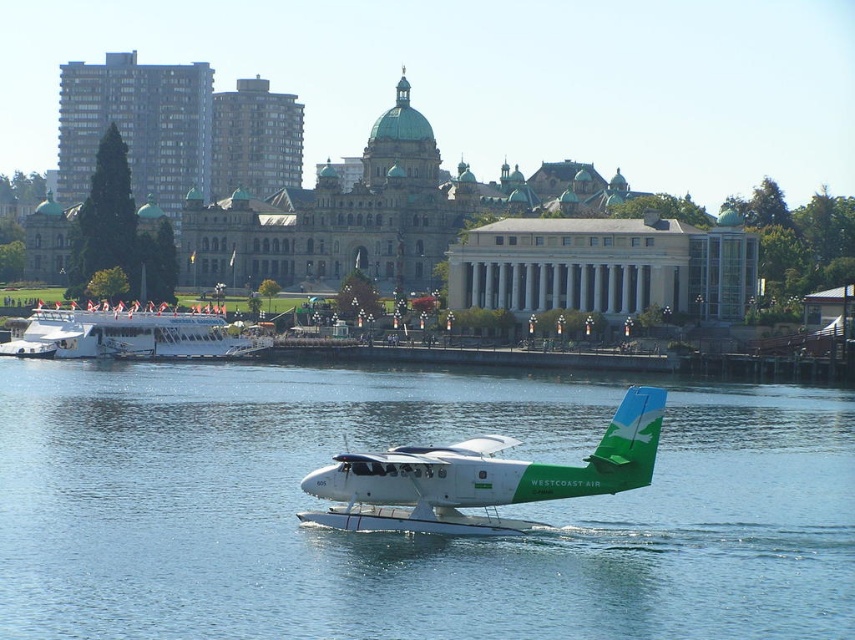
You are a photographer planning to capture the white glossy seaplane at center and the white glossy boat at left in a single frame. Based on their positions, which object should you position closer to the left side of your camera frame to include both in the shot?

The white glossy boat at left should be positioned closer to the left side of the camera frame since the white glossy seaplane at center is to the right of the white glossy boat at left.

You are a photographer planning to capture the white glossy boat at left and the blue water at center in a single shot. Based on the scene, which object will appear closer to you in the photo?

The blue water at center will appear closer to you in the photo because it is positioned in front of the white glossy boat at left.

You are a photographer planning to capture the white glossy seaplane at center and the white glossy boat at left in a single shot. Based on their positions, which one would appear closer to the camera in the photo?

The white glossy seaplane at center appears closer to the camera because it is located below the white glossy boat at left, indicating it is positioned in the foreground.